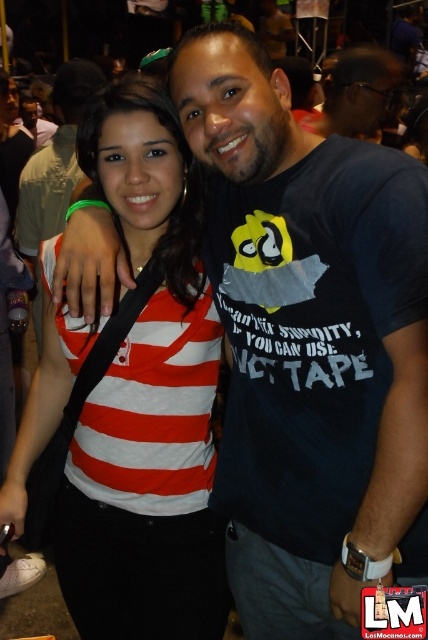
Is point (178, 147) farther from viewer compared to point (323, 109)?

No, (178, 147) is closer to viewer.

Is striped cotton shirt at center closer to the viewer compared to matte black t-shirt at upper center?

Yes, it is in front of matte black t-shirt at upper center.

Does point (154, 531) come closer to viewer compared to point (386, 99)?

Yes, point (154, 531) is in front of point (386, 99).

This screenshot has width=428, height=640. What are the coordinates of `striped cotton shirt at center` in the screenshot? It's located at (131, 401).